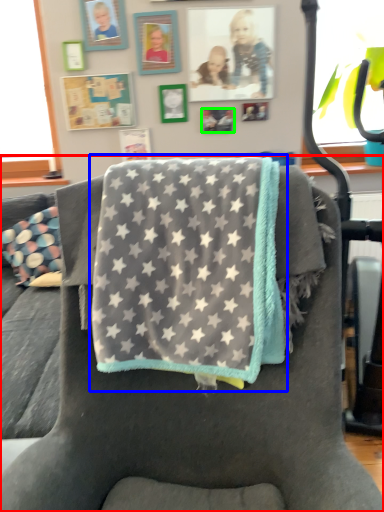
Question: Which object is positioned farthest from chair (highlighted by a red box)? Select from beach towel (highlighted by a blue box) and picture frame (highlighted by a green box).

Choices:
 (A) beach towel
 (B) picture frame

Answer: (B)